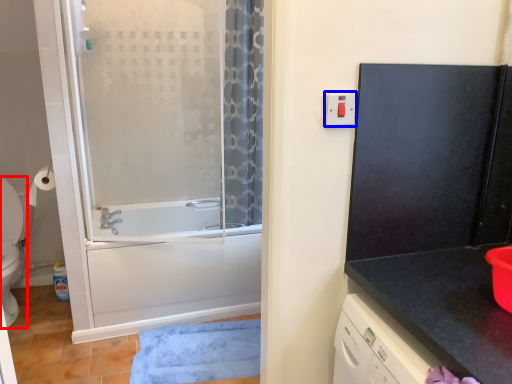
Question: Among these objects, which one is nearest to the camera, toilet (highlighted by a red box) or electric outlet (highlighted by a blue box)?

Choices:
 (A) toilet
 (B) electric outlet

Answer: (B)